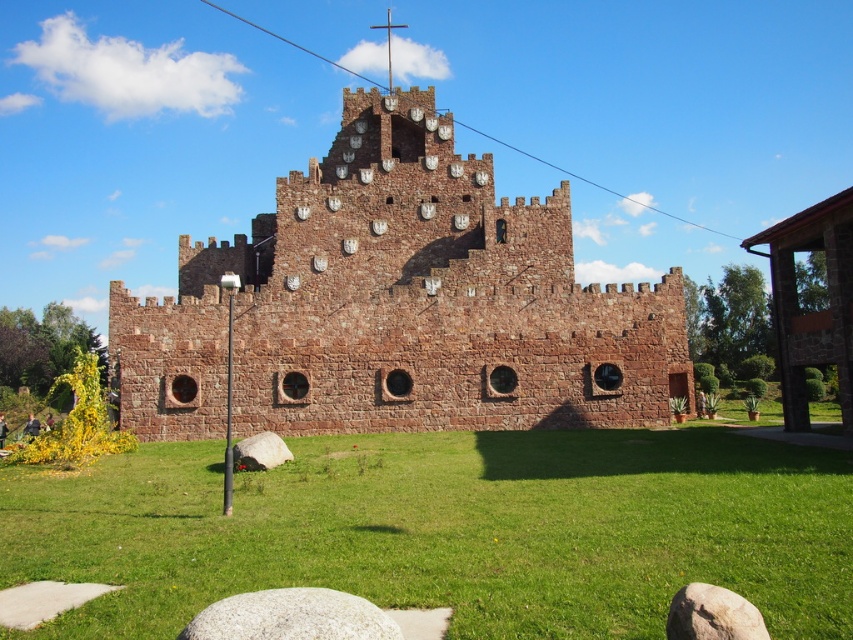
Question: Is brown stone castle at center positioned at the back of gray smooth rock at lower center?

Choices:
 (A) yes
 (B) no

Answer: (A)

Question: Can you confirm if gray granite rock at lower center is positioned below brown rough stone at lower right?

Choices:
 (A) no
 (B) yes

Answer: (B)

Question: Among these points, which one is nearest to the camera?

Choices:
 (A) (244, 452)
 (B) (654, 300)

Answer: (A)

Question: Is green grass at center smaller than brown stone castle at center?

Choices:
 (A) yes
 (B) no

Answer: (A)

Question: Which point appears farthest from the camera in this image?

Choices:
 (A) (300, 637)
 (B) (477, 296)

Answer: (B)

Question: Which point appears closest to the camera in this image?

Choices:
 (A) (540, 426)
 (B) (285, 448)

Answer: (B)